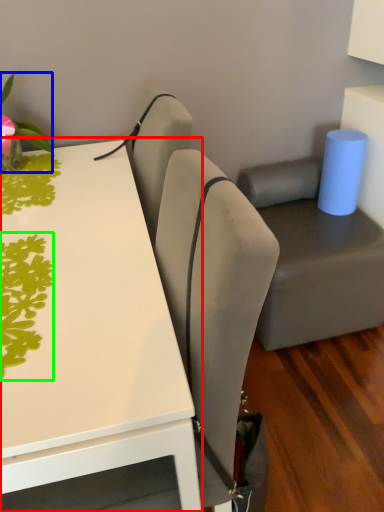
Question: Which object is positioned closest to table (highlighted by a red box)? Select from plant (highlighted by a blue box) and plant (highlighted by a green box).

Choices:
 (A) plant
 (B) plant

Answer: (B)